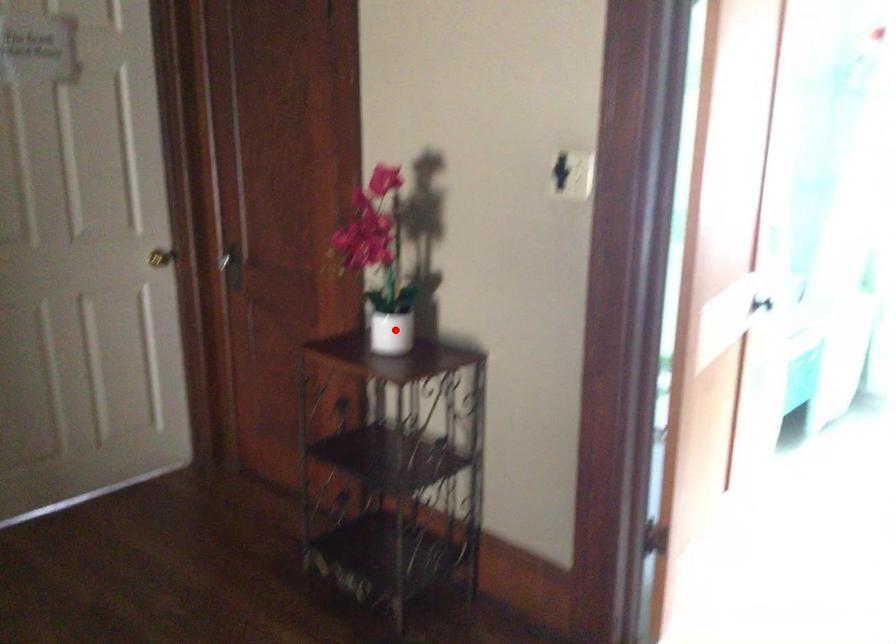
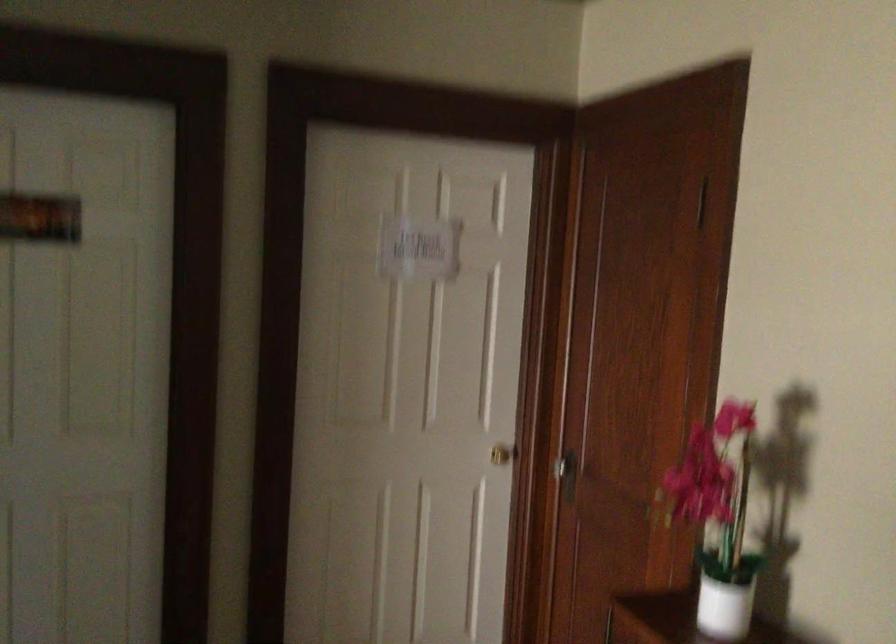
Question: I am providing you with two images of the same scene from different viewpoints. Given a red point in image1, look at the same physical point in image2. Is it:

Choices:
 (A) Closer to the viewpoint
 (B) Farther from the viewpoint

Answer: (A)